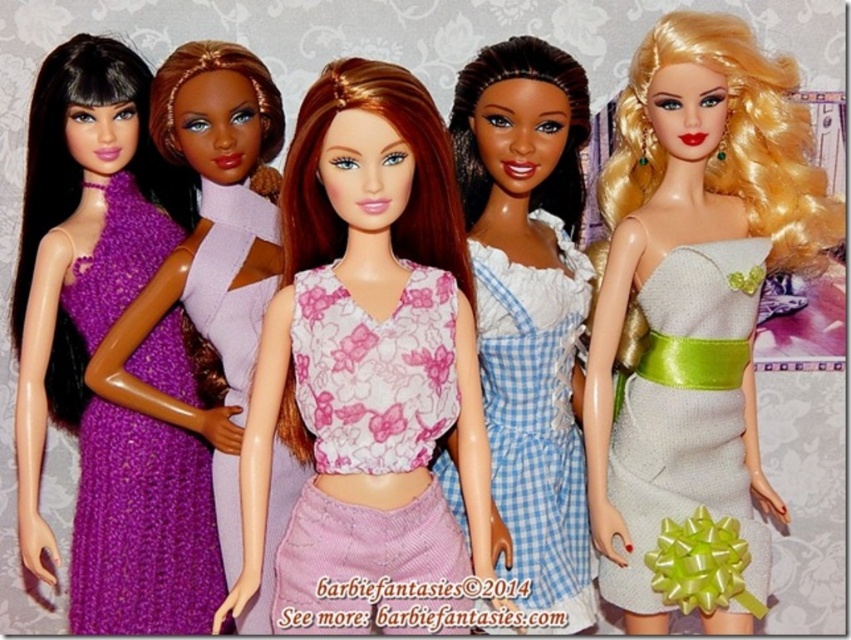
Question: Is floral fabric top at center to the left of silver sequined dress at center from the viewer's perspective?

Choices:
 (A) yes
 (B) no

Answer: (A)

Question: Can you confirm if pink floral fabric dress at center is positioned below blue checkered dress at center?

Choices:
 (A) yes
 (B) no

Answer: (A)

Question: Considering the real-world distances, which object is farthest from the purple knitted dress at center?

Choices:
 (A) blue checkered dress at center
 (B) purple knitted dress at left

Answer: (A)

Question: Which point is closer to the camera?

Choices:
 (A) [x=627, y=396]
 (B) [x=273, y=528]
 (C) [x=350, y=240]

Answer: (C)

Question: Which of the following is the farthest from the observer?

Choices:
 (A) (492, 349)
 (B) (684, 340)
 (C) (381, 464)

Answer: (A)

Question: In this image, where is pink floral fabric dress at center located relative to purple knitted dress at left?

Choices:
 (A) left
 (B) right

Answer: (B)